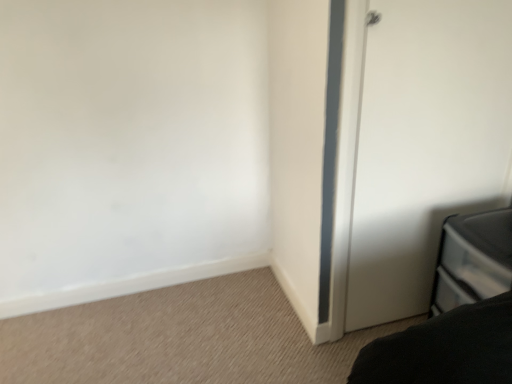
Question: From a real-world perspective, is white matte door at right positioned above or below black plastic drawer at lower right?

Choices:
 (A) below
 (B) above

Answer: (B)

Question: Is white matte door at right spatially inside black plastic drawer at lower right, or outside of it?

Choices:
 (A) outside
 (B) inside

Answer: (A)

Question: Visually, is white matte door at right positioned to the left or to the right of black plastic drawer at lower right?

Choices:
 (A) left
 (B) right

Answer: (A)

Question: From a real-world perspective, is black plastic drawer at lower right physically located above or below white matte door at right?

Choices:
 (A) below
 (B) above

Answer: (A)

Question: Is black plastic drawer at lower right inside or outside of white matte door at right?

Choices:
 (A) inside
 (B) outside

Answer: (B)

Question: Looking at the image, does black plastic drawer at lower right seem bigger or smaller compared to white matte door at right?

Choices:
 (A) big
 (B) small

Answer: (A)

Question: In the image, is black plastic drawer at lower right positioned in front of or behind white matte door at right?

Choices:
 (A) front
 (B) behind

Answer: (A)